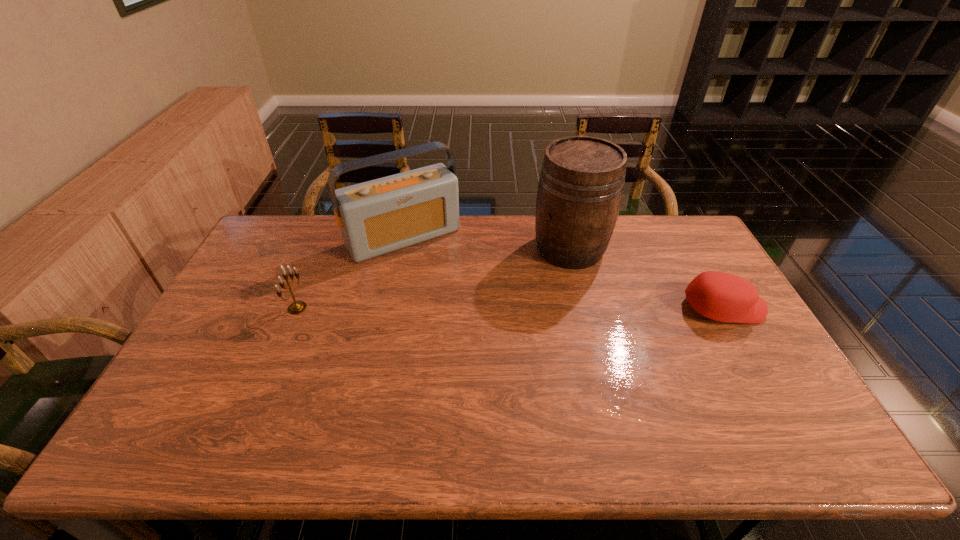
At what (x,y) coordinates should I click in order to perform the action: click on vacant area at the far right corner. Please return your answer as a coordinate pair (x, y). The width and height of the screenshot is (960, 540). Looking at the image, I should click on (671, 249).

This screenshot has width=960, height=540. In order to click on free area in between the cider and the cap in this screenshot , I will do `click(646, 278)`.

Locate an element on the screen. The width and height of the screenshot is (960, 540). free point between the third object from left to right and the leftmost object is located at coordinates (434, 278).

What are the coordinates of `free spot between the candelabrum and the cider` in the screenshot? It's located at (434, 278).

I want to click on free space between the third tallest object and the radio receiver, so click(x=350, y=273).

What are the coordinates of `empty space between the radio receiver and the third object from left to right` in the screenshot? It's located at (487, 243).

This screenshot has height=540, width=960. I want to click on empty location between the radio receiver and the cider, so click(487, 243).

In order to click on free area in between the third object from right to left and the cap in this screenshot , I will do `click(564, 273)`.

Identify the location of empty space that is in between the leftmost object and the second object from right to left. This screenshot has width=960, height=540. (434, 278).

Identify the location of vacant area that lies between the third object from left to right and the radio receiver. The image size is (960, 540). (487, 243).